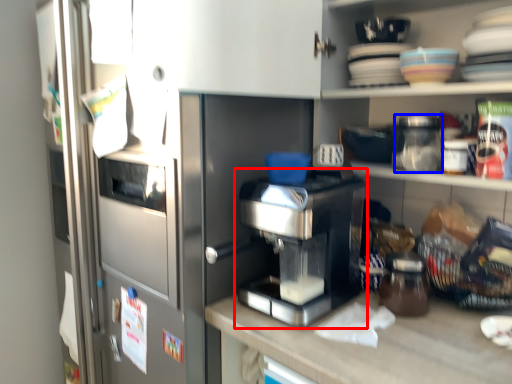
Question: Which point is closer to the camera, home appliance (highlighted by a red box) or glass jar (highlighted by a blue box)?

Choices:
 (A) home appliance
 (B) glass jar

Answer: (A)